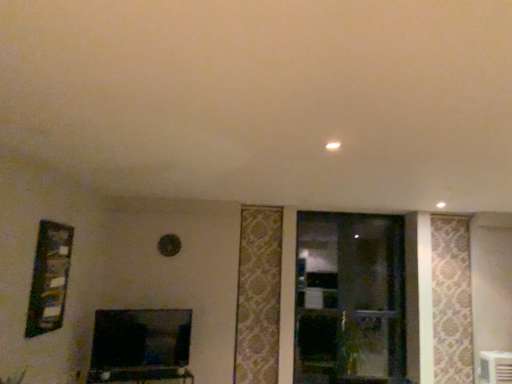
Question: In terms of height, does transparent glass window at center look taller or shorter compared to matte black tv stand at lower center?

Choices:
 (A) short
 (B) tall

Answer: (B)

Question: In the image, is transparent glass window at center on the left side or the right side of matte black tv stand at lower center?

Choices:
 (A) right
 (B) left

Answer: (A)

Question: Based on their relative distances, which object is nearer to the white plastic air conditioner at lower right?

Choices:
 (A) wooden frame at left
 (B) transparent glass window at center
 (C) matte black tv stand at lower center
 (D) matte black tv at lower center
 (E) green leafy plant at center

Answer: (E)

Question: Estimate the real-world distances between objects in this image. Which object is farther from the white plastic air conditioner at lower right?

Choices:
 (A) matte black tv stand at lower center
 (B) matte black tv at lower center
 (C) wooden frame at left
 (D) green leafy plant at center
 (E) transparent glass window at center

Answer: (C)